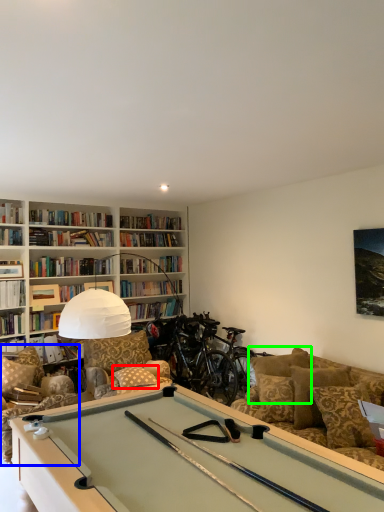
Question: Estimate the real-world distances between objects in this image. Which object is closer to pillow (highlighted by a red box), swivel chair (highlighted by a blue box) or pillow (highlighted by a green box)?

Choices:
 (A) swivel chair
 (B) pillow

Answer: (A)